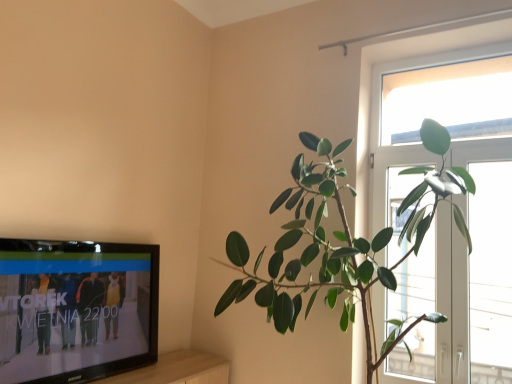
Question: Is transparent glass window at right, the first window from the right, at the right side of green glossy plant at right?

Choices:
 (A) no
 (B) yes

Answer: (B)

Question: Considering the relative sizes of transparent glass window at right, arranged as the second window when viewed from the left, and green glossy plant at right in the image provided, is transparent glass window at right, arranged as the second window when viewed from the left, smaller than green glossy plant at right?

Choices:
 (A) no
 (B) yes

Answer: (B)

Question: Can green glossy plant at right be found inside transparent glass window at right, arranged as the second window when viewed from the left?

Choices:
 (A) no
 (B) yes

Answer: (A)

Question: Is transparent glass window at right, arranged as the second window when viewed from the left, directly adjacent to green glossy plant at right?

Choices:
 (A) yes
 (B) no

Answer: (B)

Question: Can you confirm if transparent glass window at right, arranged as the second window when viewed from the left, is bigger than green glossy plant at right?

Choices:
 (A) yes
 (B) no

Answer: (B)

Question: Does transparent glass window at right, arranged as the second window when viewed from the left, have a lesser height compared to green glossy plant at right?

Choices:
 (A) yes
 (B) no

Answer: (A)

Question: Does transparent glass window at upper right, arranged as the 2th window when viewed from the right, have a lesser height compared to transparent glass window at right, the first window from the right?

Choices:
 (A) no
 (B) yes

Answer: (A)

Question: Is transparent glass window at upper right, the 1th window from the left, completely or partially outside of transparent glass window at right, arranged as the second window when viewed from the left?

Choices:
 (A) yes
 (B) no

Answer: (A)

Question: Is transparent glass window at upper right, arranged as the 2th window when viewed from the right, aimed at transparent glass window at right, the first window from the right?

Choices:
 (A) no
 (B) yes

Answer: (B)

Question: Is transparent glass window at upper right, arranged as the 2th window when viewed from the right, looking in the opposite direction of transparent glass window at right, the first window from the right?

Choices:
 (A) no
 (B) yes

Answer: (B)

Question: Is transparent glass window at upper right, arranged as the 2th window when viewed from the right, positioned before transparent glass window at right, the first window from the right?

Choices:
 (A) no
 (B) yes

Answer: (A)

Question: Is transparent glass window at upper right, arranged as the 2th window when viewed from the right, at the left side of transparent glass window at right, arranged as the second window when viewed from the left?

Choices:
 (A) no
 (B) yes

Answer: (B)

Question: Does transparent glass window at upper right have a greater width compared to transparent glass window at upper right, arranged as the 2th window when viewed from the right?

Choices:
 (A) yes
 (B) no

Answer: (B)